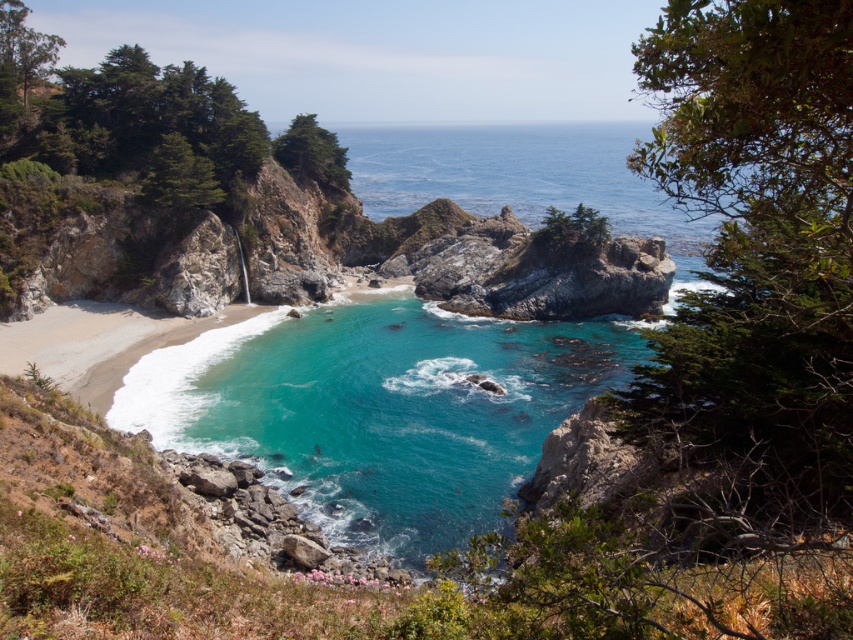
Question: In this image, where is turquoise glossy water at center located relative to clear blue water at center?

Choices:
 (A) above
 (B) below

Answer: (B)

Question: Does turquoise glossy water at center come behind clear blue water at center?

Choices:
 (A) yes
 (B) no

Answer: (B)

Question: Does turquoise glossy water at center lie in front of clear blue water at center?

Choices:
 (A) no
 (B) yes

Answer: (B)

Question: Which of the following is the farthest from the observer?

Choices:
 (A) turquoise glossy water at center
 (B) clear blue water at center

Answer: (B)